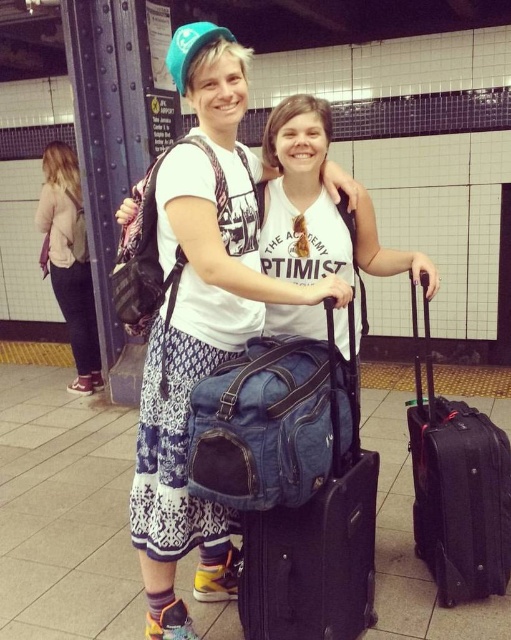
Is black hardshell suitcase at right to the left of light pink sweater at left from the viewer's perspective?

Incorrect, black hardshell suitcase at right is not on the left side of light pink sweater at left.

This screenshot has height=640, width=511. I want to click on black hardshell suitcase at right, so click(x=456, y=484).

Locate an element on the screen. black hardshell suitcase at right is located at coordinates (456, 484).

Which is more to the right, denim fabric suitcase at center or light pink sweater at left?

denim fabric suitcase at center

Where is `denim fabric suitcase at center`? The height and width of the screenshot is (640, 511). denim fabric suitcase at center is located at coordinates (316, 540).

Where is `denim fabric suitcase at center`? denim fabric suitcase at center is located at coordinates (316, 540).

Is white cotton shirt at center to the left of black hardshell suitcase at right from the viewer's perspective?

Indeed, white cotton shirt at center is positioned on the left side of black hardshell suitcase at right.

Is white cotton shirt at center wider than black hardshell suitcase at right?

Yes, white cotton shirt at center is wider than black hardshell suitcase at right.

Is point (300, 285) positioned after point (415, 336)?

No, it is in front of (415, 336).

Identify the location of white cotton shirt at center. This screenshot has width=511, height=640. (199, 323).